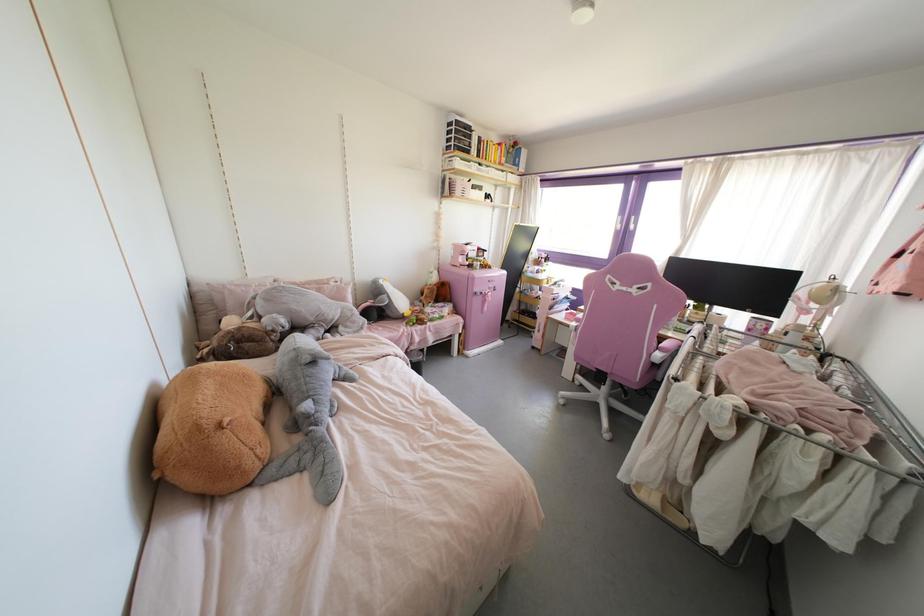
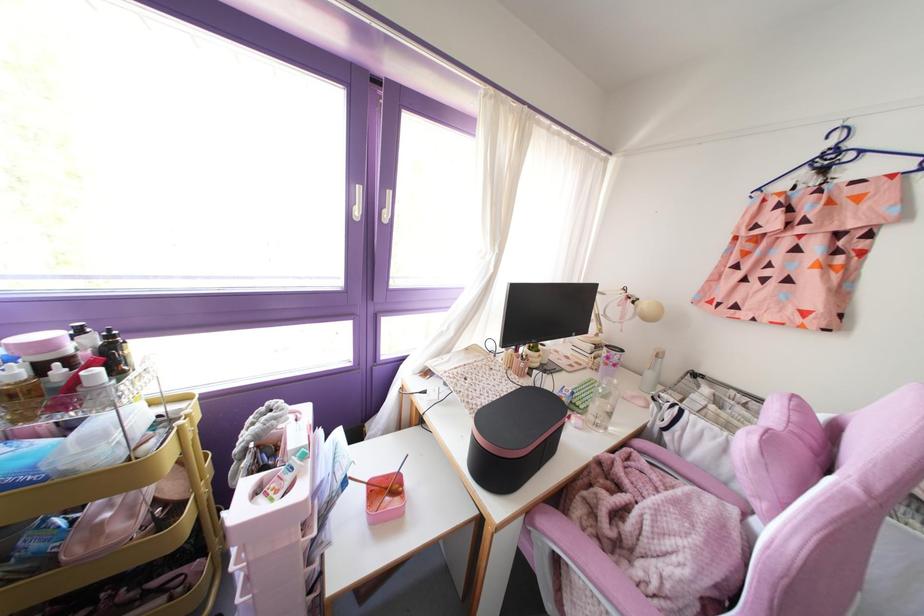
Find the pixel in the second image that matches point 748,329 in the first image.

(614, 365)